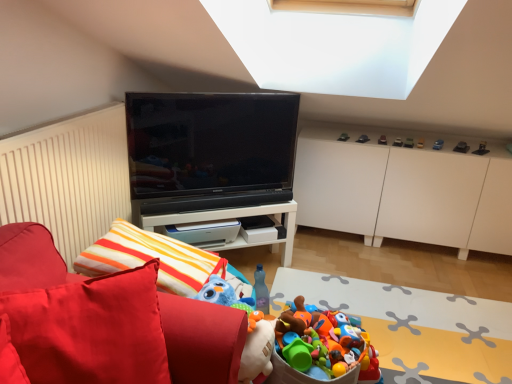
The height and width of the screenshot is (384, 512). Identify the location of free space in front of metallic black toy car at upper right, marked as the 9th toy in a top-to-bottom arrangement. (489, 153).